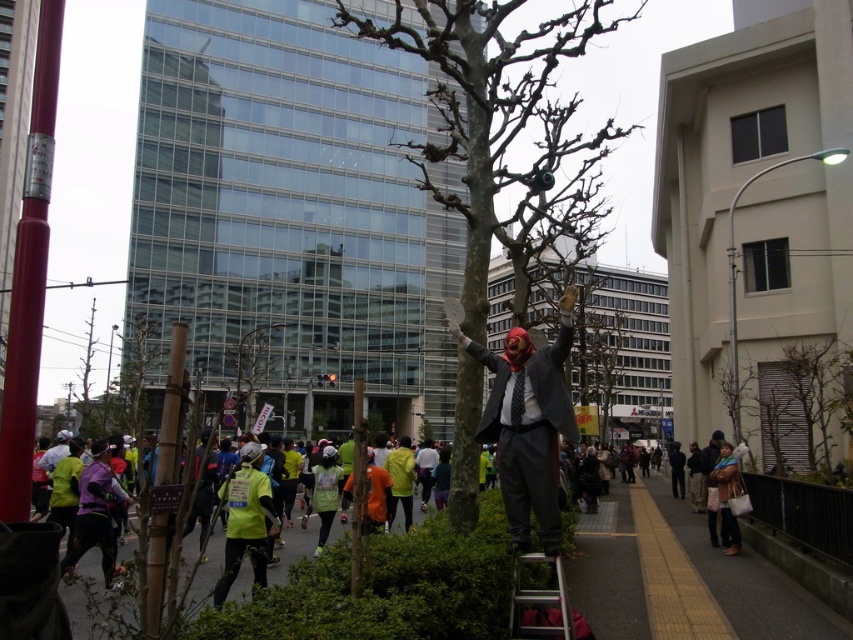
You are a photographer trying to capture a runner wearing a matte black suit at center and a silver metallic ladder at lower center in the same frame. Which object should you focus on first to ensure both are in the shot?

You should focus on the silver metallic ladder at lower center first because the matte black suit at center is positioned to its right, ensuring both are within the frame when starting from the ladder.

You are a photographer trying to capture a photo of the matte black suit at center and the silver metallic ladder at lower center. Since you want both subjects to appear equally sized in the final image, which object should you move closer to?

The matte black suit at center is wider than the silver metallic ladder at lower center, so you should move closer to the silver metallic ladder at lower center to make it appear larger in the photo, balancing their sizes.

You are a city planner assessing the space between the bare wood tree at center and the silver metallic ladder at lower center. Given that the ladder must be moved to accommodate a new pathway, which object should be relocated first to ensure the path is wide enough for pedestrians?

The silver metallic ladder at lower center should be relocated first since it is smaller in size than the bare wood tree at center, making it easier to move out of the way.